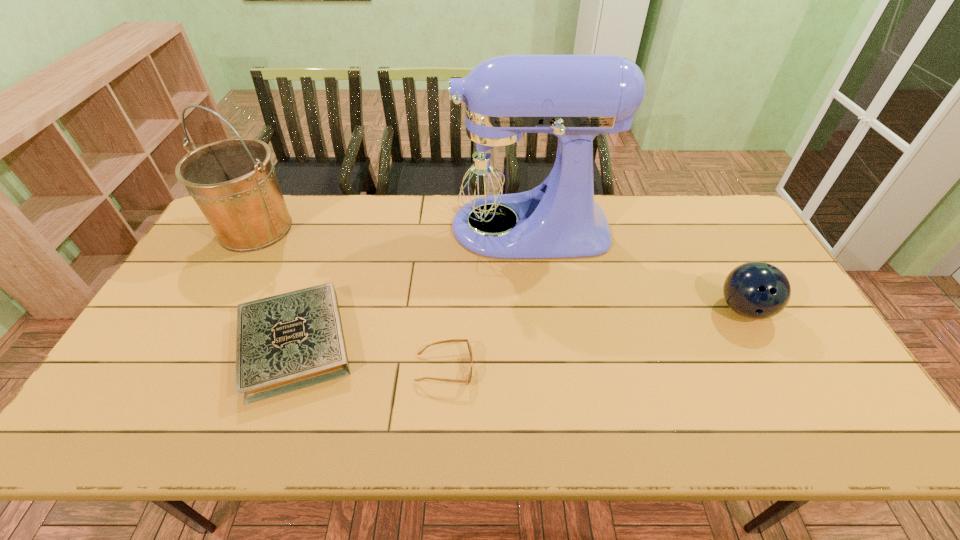
Where is `blank area located on the surface of the third shortest object near the finger holes`? blank area located on the surface of the third shortest object near the finger holes is located at coordinates (779, 374).

Locate an element on the screen. free space located on the back of the hardback book is located at coordinates (334, 233).

The width and height of the screenshot is (960, 540). Identify the location of free location located on the front-facing side of the sunglasses. (516, 369).

Identify the location of mixer present at the far edge. Image resolution: width=960 pixels, height=540 pixels. (494, 168).

Locate an element on the screen. The width and height of the screenshot is (960, 540). bucket located at the far edge is located at coordinates (233, 181).

Locate an element on the screen. object at the left edge is located at coordinates (233, 181).

The width and height of the screenshot is (960, 540). Identify the location of object that is at the right edge. (756, 290).

Find the location of a particular element. object at the far left corner is located at coordinates (233, 181).

Where is `vacant space at the far edge of the desktop`? This screenshot has width=960, height=540. vacant space at the far edge of the desktop is located at coordinates (648, 235).

In the image, there is a desktop. Where is `free space at the near edge`? This screenshot has width=960, height=540. free space at the near edge is located at coordinates (386, 415).